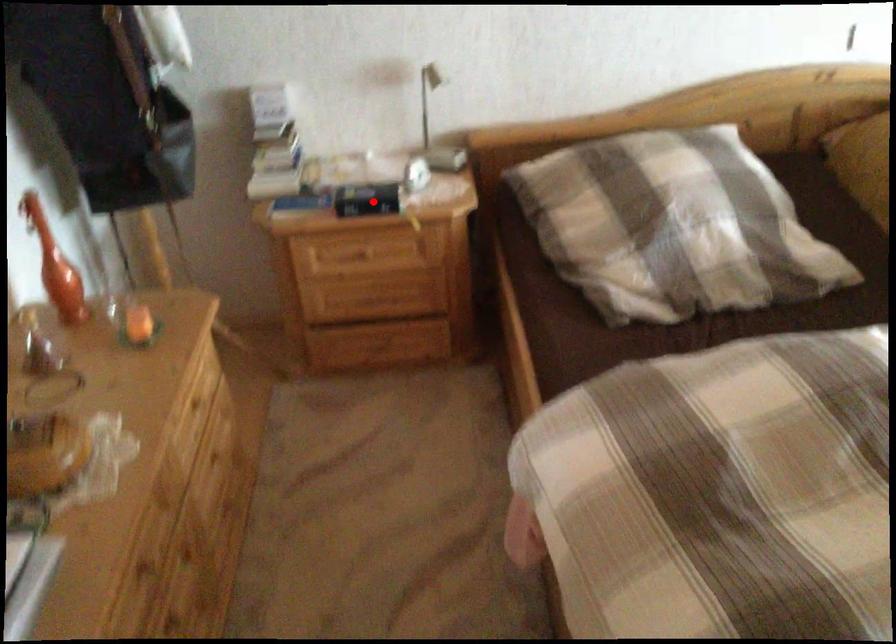
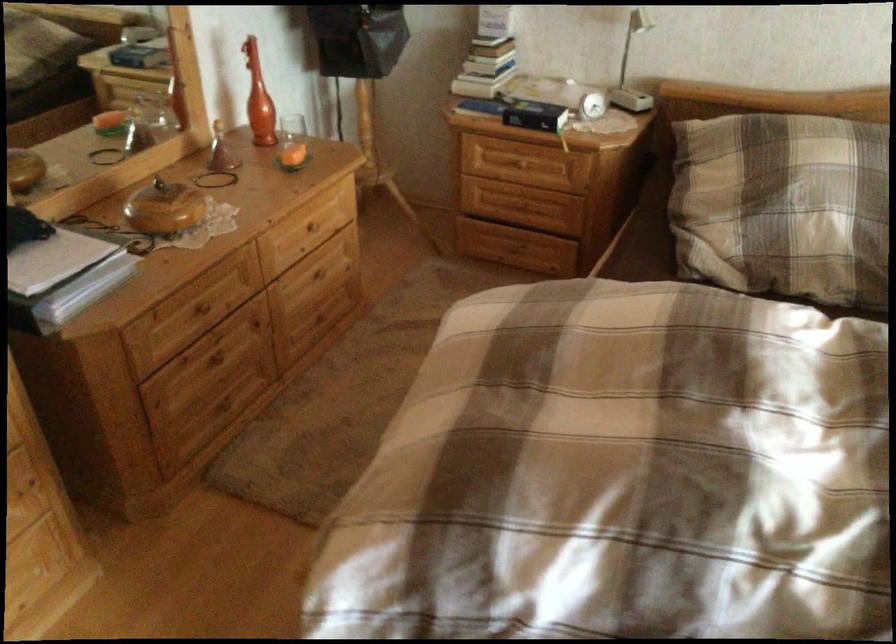
Find the pixel in the second image that matches the highlighted location in the first image.

(535, 115)